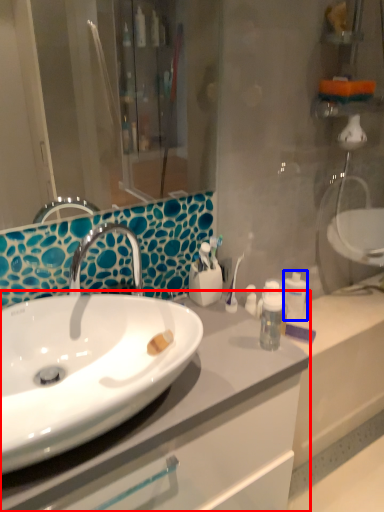
Question: Which point is further to the camera, bathroom cabinet (highlighted by a red box) or mouthwash (highlighted by a blue box)?

Choices:
 (A) bathroom cabinet
 (B) mouthwash

Answer: (B)